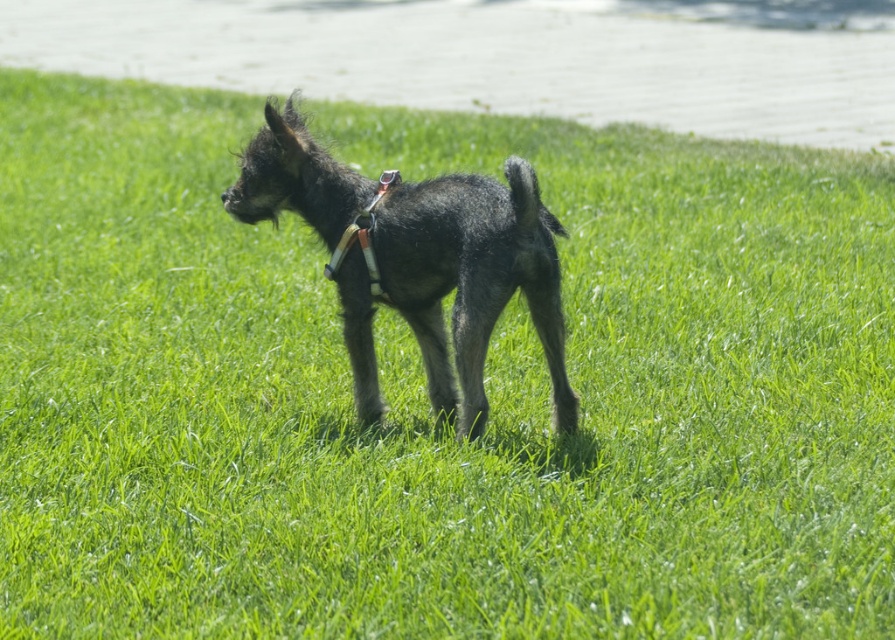
Does point (419, 316) come closer to viewer compared to point (334, 256)?

That is False.

Does shiny black dog at center have a lesser width compared to white leather neckband at center?

In fact, shiny black dog at center might be wider than white leather neckband at center.

Is point (466, 298) in front of point (350, 224)?

Yes, point (466, 298) is closer to viewer.

Identify the location of shiny black dog at center. (412, 262).

Who is lower down, shiny black dog at center or black fuzzy tail at center?

shiny black dog at center is lower down.

This screenshot has height=640, width=895. Find the location of `shiny black dog at center`. shiny black dog at center is located at coordinates (412, 262).

Find the location of a particular element. Image resolution: width=895 pixels, height=640 pixels. shiny black dog at center is located at coordinates (412, 262).

In the scene shown: Who is shorter, white leather neckband at center or black fuzzy tail at center?

With less height is black fuzzy tail at center.

Which is behind, point (362, 228) or point (537, 196)?

Positioned behind is point (362, 228).

Where is `white leather neckband at center`? This screenshot has height=640, width=895. white leather neckband at center is located at coordinates (363, 236).